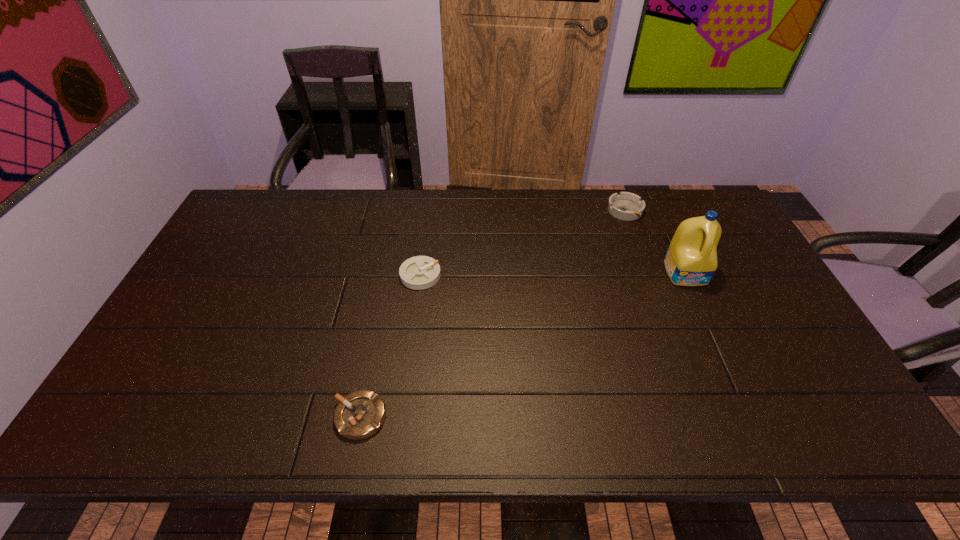
At what (x,y) coordinates should I click in order to perform the action: click on vacant space that satisfies the following two spatial constraints: 1. on the back side of the farthest object; 2. on the left side of the second nearest ashtray. Please return your answer as a coordinate pair (x, y). This screenshot has width=960, height=540. Looking at the image, I should click on (429, 211).